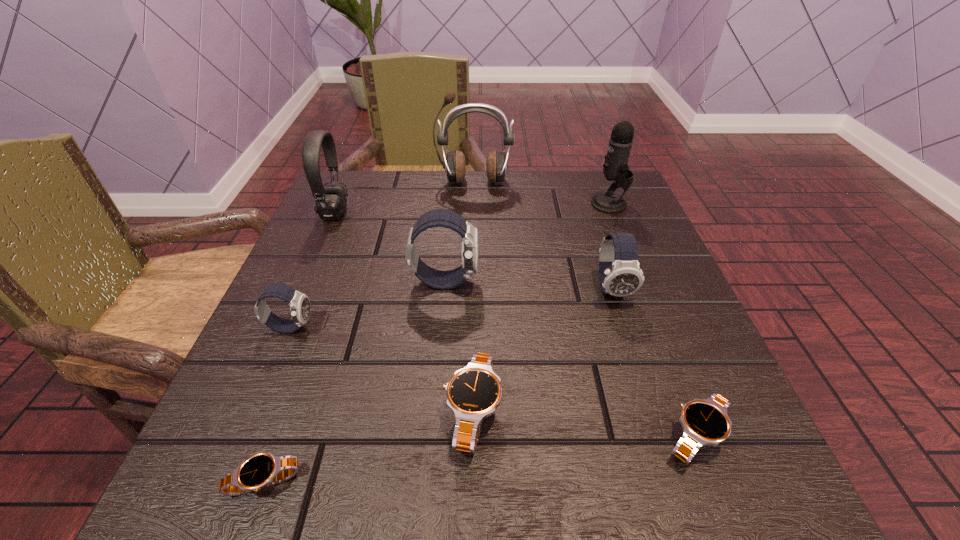
Find the location of a particular element. vacant area that lies between the smallest black watch and the second shortest object is located at coordinates (480, 460).

Identify the location of vacant point located between the black microphone and the seventh tallest object. (541, 308).

At what (x,y) coordinates should I click in order to perform the action: click on vacant space that's between the fifth shortest watch and the fifth tallest watch. Please return your answer as a coordinate pair (x, y). Looking at the image, I should click on (654, 363).

The width and height of the screenshot is (960, 540). In order to click on vacant space that is in between the smallest dark watch and the microphone in this screenshot , I will do `click(450, 266)`.

Where is `free space between the black microphone and the shortest watch`? The image size is (960, 540). free space between the black microphone and the shortest watch is located at coordinates (437, 343).

Where is `vacant space that is in between the leftmost black watch and the rightmost dark watch`? The width and height of the screenshot is (960, 540). vacant space that is in between the leftmost black watch and the rightmost dark watch is located at coordinates (438, 386).

Identify the location of free spot between the farthest object and the second biggest dark watch. Image resolution: width=960 pixels, height=540 pixels. (542, 235).

Locate an element on the screen. The width and height of the screenshot is (960, 540). free space between the leftmost black watch and the black microphone is located at coordinates (437, 343).

Locate an element on the screen. The width and height of the screenshot is (960, 540). vacant space in between the biggest dark watch and the fourth shortest watch is located at coordinates (368, 304).

Choose which object is the eighth nearest neighbor to the brown earphone. Please provide its 2D coordinates. Your answer should be formatted as a tuple, i.e. [(x, y)], where the tuple contains the x and y coordinates of a point satisfying the conditions above.

[(263, 469)]